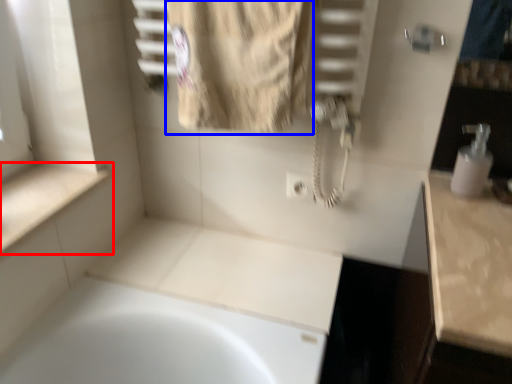
Question: Which point is closer to the camera, counter top (highlighted by a red box) or bath towel (highlighted by a blue box)?

Choices:
 (A) counter top
 (B) bath towel

Answer: (B)